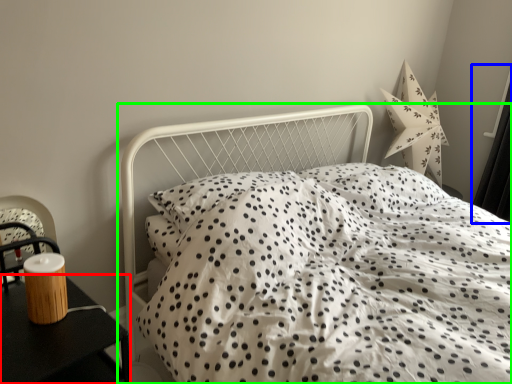
Question: Which object is the farthest from nightstand (highlighted by a red box)? Choose among these: curtain (highlighted by a blue box) or bed (highlighted by a green box).

Choices:
 (A) curtain
 (B) bed

Answer: (A)